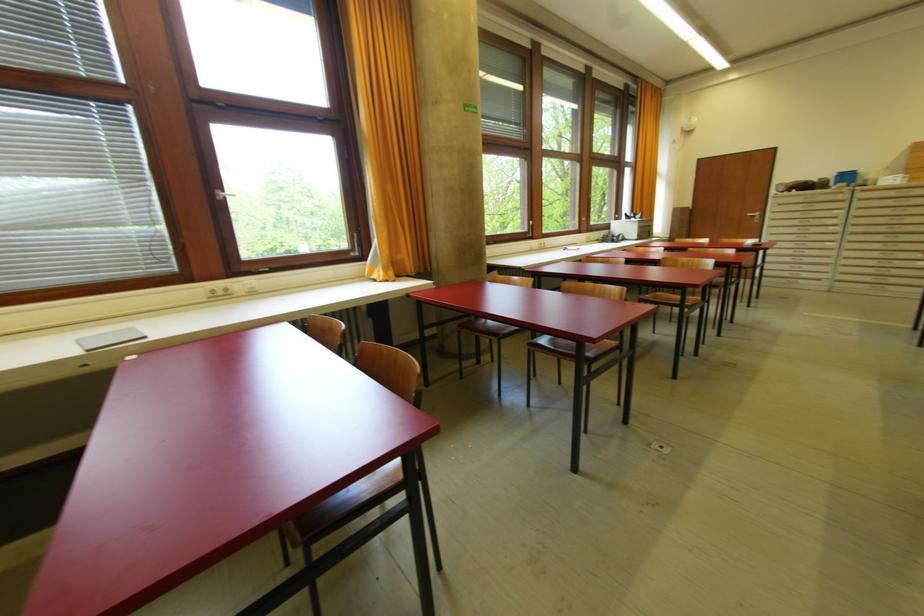
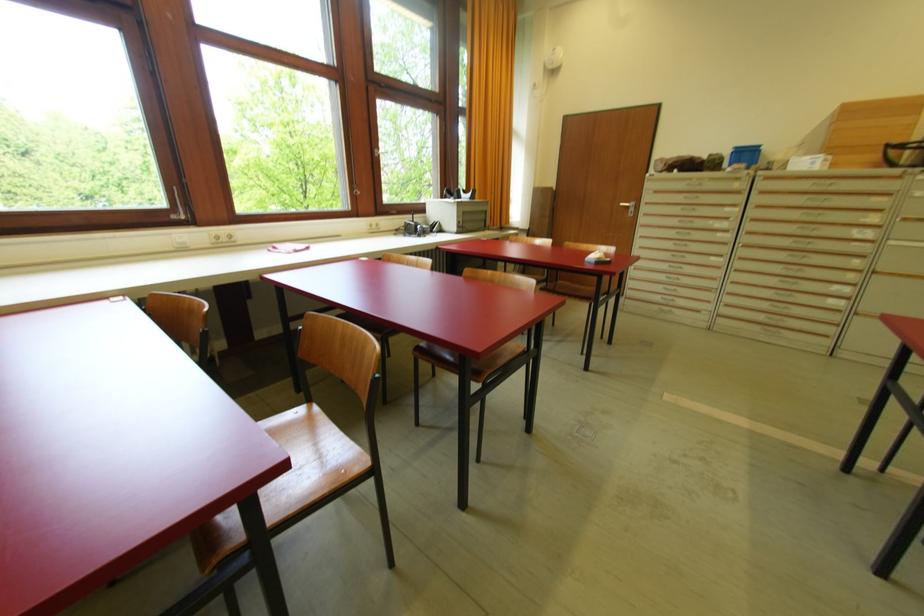
Where in the second image is the point corresponding to (833,177) from the first image?

(728, 155)